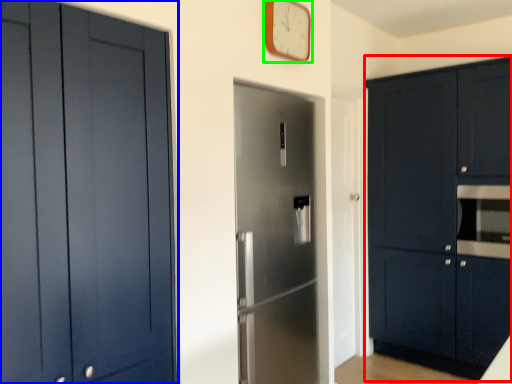
Question: Which object is positioned closest to cabinetry (highlighted by a red box)? Select from cabinetry (highlighted by a blue box) and clock (highlighted by a green box).

Choices:
 (A) cabinetry
 (B) clock

Answer: (B)